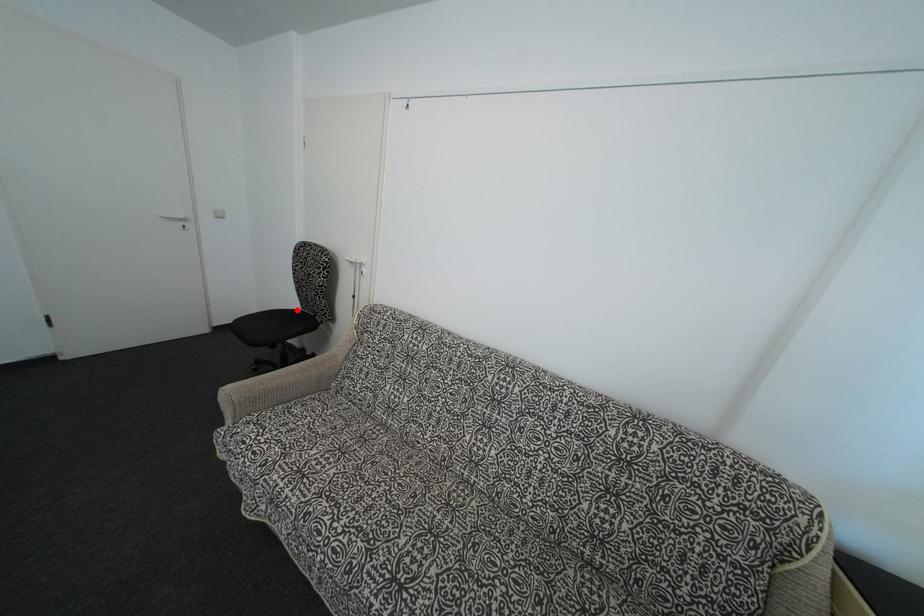
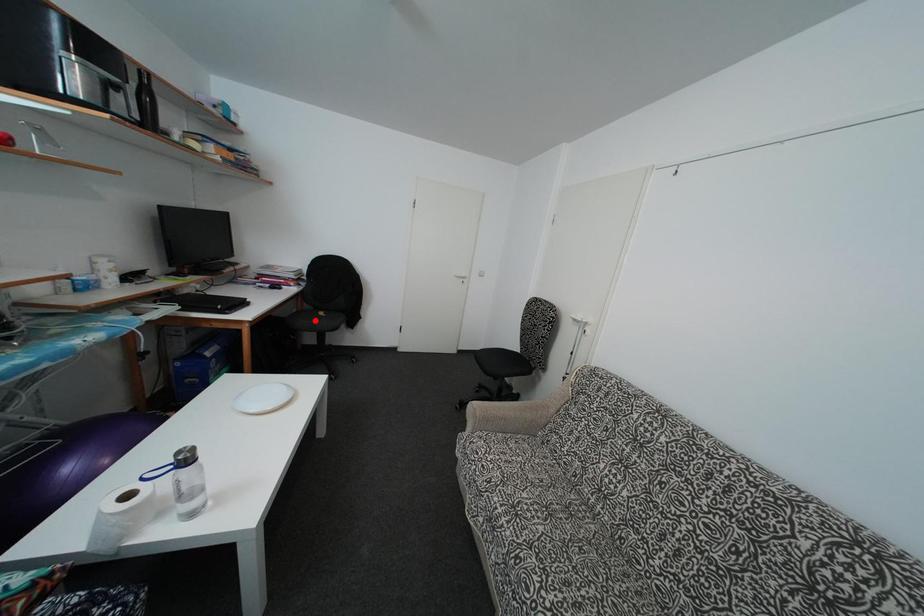
I am providing you with two images of the same scene from different viewpoints. A red point is marked on the first image and another point is marked on the second image. Is the marked point in image1 the same physical position as the marked point in image2?

No